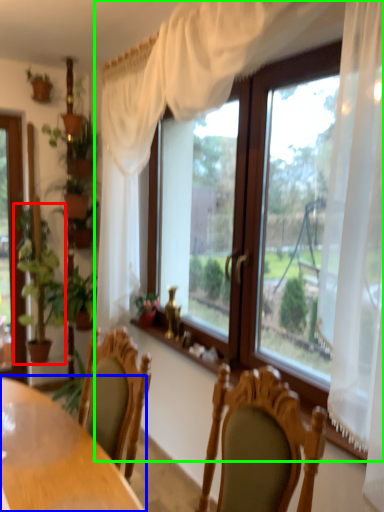
Question: Which object is positioned closest to houseplant (highlighted by a red box)? Select from table (highlighted by a blue box) and window (highlighted by a green box).

Choices:
 (A) table
 (B) window

Answer: (B)